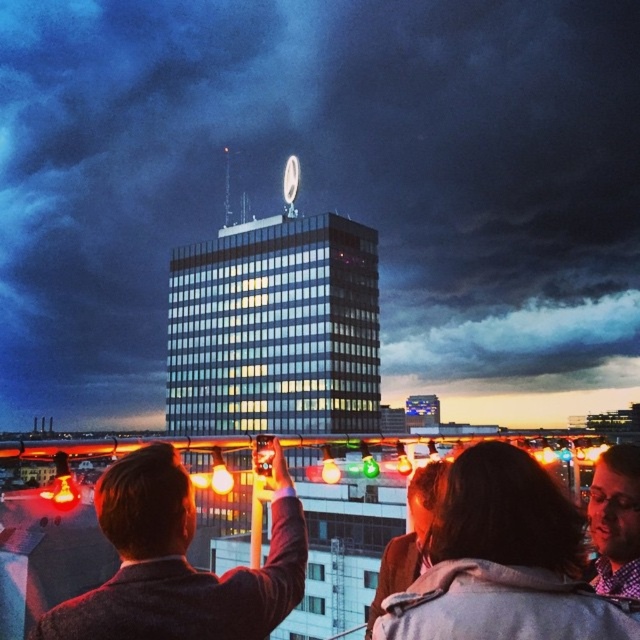
You are a photographer trying to capture the Mercedes Benz logo on the building. You notice two people in the scene, one with dark brown hair at center and another wearing a plaid shirt at lower right. Which person is closer to the logo so you can ask them to move?

The dark brown hair at center is taller than the plaid shirt at lower right, so the person with dark brown hair at center is closer to the logo and should be asked to move.

You are a photographer trying to capture the Mercedes Benz logo on the building. You notice two elements in the foreground that might block your shot. Which of the two, the dark brown hair at center or the smooth brown jacket at upper left, is narrower and less likely to obstruct your view?

The dark brown hair at center is narrower than the smooth brown jacket at upper left, so it is less likely to obstruct your view.